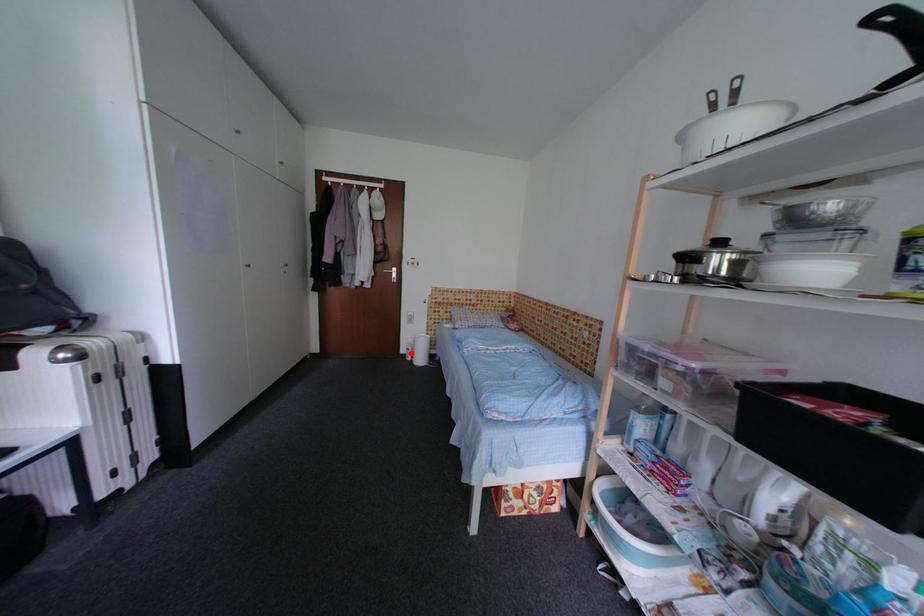
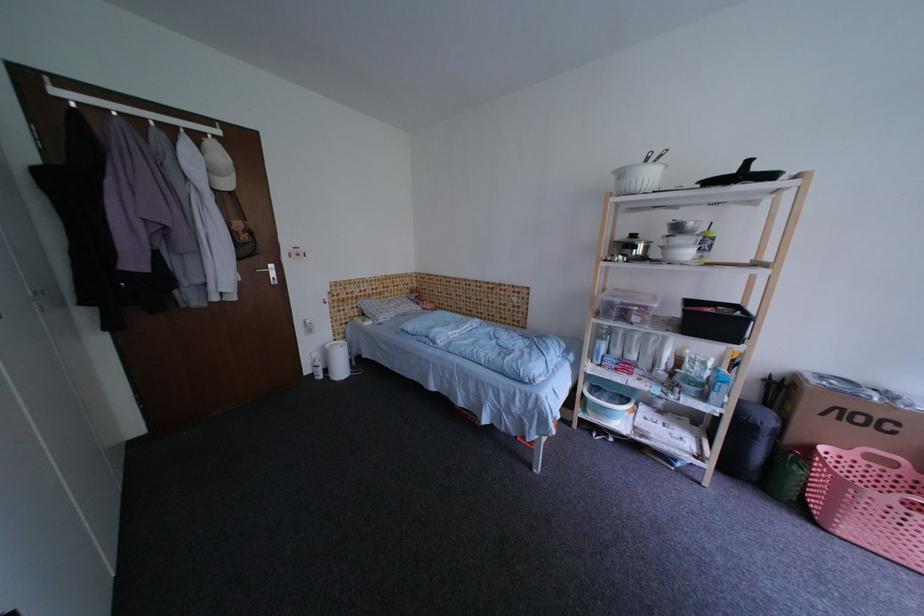
In the second image, find the point that corresponds to the highlighted location in the first image.

(314, 374)